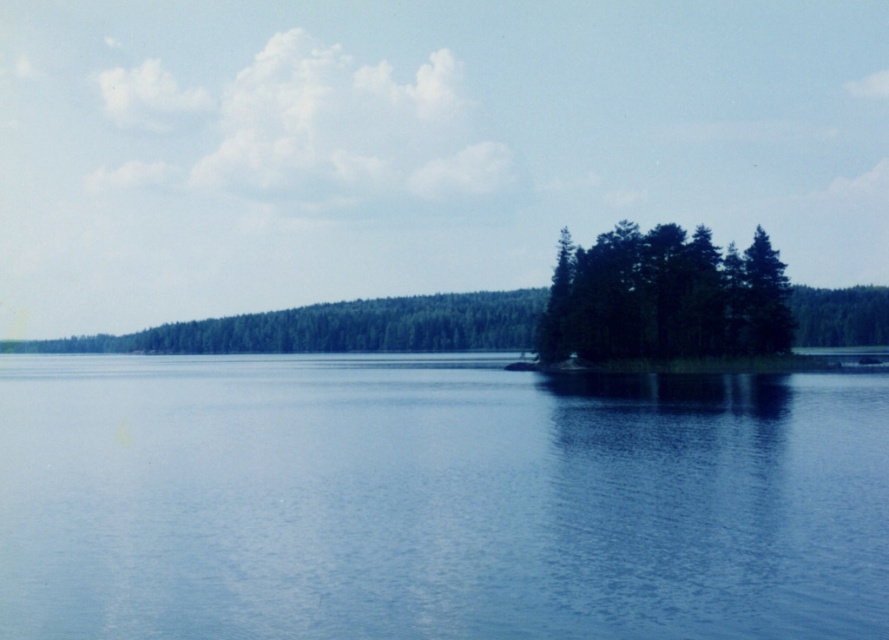
Can you confirm if blue smooth water at center is shorter than green matte tree at right?

Correct, blue smooth water at center is not as tall as green matte tree at right.

Between point (577, 524) and point (847, 288), which one is positioned behind?

Positioned behind is point (847, 288).

Locate an element on the screen. Image resolution: width=889 pixels, height=640 pixels. blue smooth water at center is located at coordinates (435, 500).

Is point (653, 250) positioned in front of point (881, 301)?

That is True.

The image size is (889, 640). Describe the element at coordinates (663, 298) in the screenshot. I see `green matte trees at center` at that location.

Locate an element on the screen. green matte trees at center is located at coordinates (663, 298).

Find the location of a particular element. The image size is (889, 640). green matte trees at center is located at coordinates (x=663, y=298).

At what (x,y) coordinates should I click in order to perform the action: click on blue smooth water at center. Please return your answer as a coordinate pair (x, y). Image resolution: width=889 pixels, height=640 pixels. Looking at the image, I should click on (435, 500).

Measure the distance between blue smooth water at center and camera.

blue smooth water at center and camera are 18.63 meters apart from each other.

This screenshot has width=889, height=640. What do you see at coordinates (435, 500) in the screenshot?
I see `blue smooth water at center` at bounding box center [435, 500].

At what (x,y) coordinates should I click in order to perform the action: click on blue smooth water at center. Please return your answer as a coordinate pair (x, y). The height and width of the screenshot is (640, 889). Looking at the image, I should click on (435, 500).